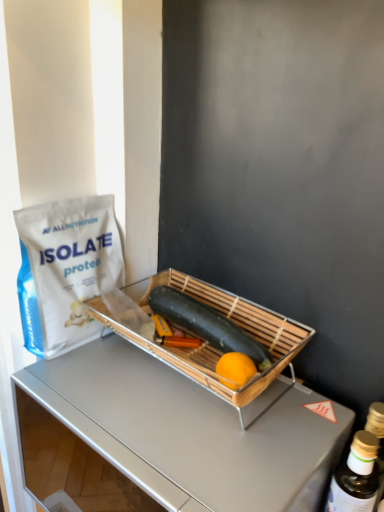
Locate an element on the screen. The width and height of the screenshot is (384, 512). smooth green zucchini at center is located at coordinates (207, 324).

Find the location of a particular element. The width and height of the screenshot is (384, 512). gold metallic bottle at right is located at coordinates (x=356, y=477).

What do you see at coordinates (212, 347) in the screenshot?
I see `bamboo tray at center` at bounding box center [212, 347].

The height and width of the screenshot is (512, 384). Describe the element at coordinates (65, 270) in the screenshot. I see `white matte protein powder bag at left` at that location.

Identify the location of smooth green zucchini at center. (207, 324).

Between smooth green zucchini at center and bamboo tray at center, which one has larger size?

With larger size is bamboo tray at center.

Where is `green vegetables behind the bamboo tray at center`? The width and height of the screenshot is (384, 512). green vegetables behind the bamboo tray at center is located at coordinates (207, 324).

Can we say smooth green zucchini at center lies outside bamboo tray at center?

No, smooth green zucchini at center is not entirely external to bamboo tray at center.

In the scene shown: From a real-world perspective, is smooth green zucchini at center on top of bamboo tray at center?

Yes.

Is point (29, 311) in front of point (215, 320)?

No.

Considering their positions, is white matte protein powder bag at left located in front of or behind smooth green zucchini at center?

white matte protein powder bag at left is in front of smooth green zucchini at center.

Identify the location of green vegetables below the white matte protein powder bag at left (from a real-world perspective). (207, 324).

Considering the positions of objects white matte protein powder bag at left and smooth green zucchini at center in the image provided, who is more to the right, white matte protein powder bag at left or smooth green zucchini at center?

Positioned to the right is smooth green zucchini at center.

From a real-world perspective, between bamboo tray at center and white matte protein powder bag at left, who is vertically higher?

white matte protein powder bag at left is physically above.

Is point (109, 318) positioned behind point (68, 324)?

Yes, it is.

From the picture: Is bamboo tray at center oriented towards white matte protein powder bag at left?

No, bamboo tray at center does not turn towards white matte protein powder bag at left.

I want to click on appliance on the right of white matte protein powder bag at left, so click(x=212, y=347).

In terms of height, does bamboo tray at center look taller or shorter compared to metallic silver desk at center?

Clearly, bamboo tray at center is shorter compared to metallic silver desk at center.

Can metallic silver desk at center be found inside bamboo tray at center?

No, metallic silver desk at center is not inside bamboo tray at center.

Is bamboo tray at center aimed at metallic silver desk at center?

No, bamboo tray at center is not turned towards metallic silver desk at center.

Between bamboo tray at center and metallic silver desk at center, which one appears on the right side from the viewer's perspective?

Positioned to the right is bamboo tray at center.

Based on their sizes in the image, would you say gold metallic bottle at right is bigger or smaller than bamboo tray at center?

Clearly, gold metallic bottle at right is smaller in size than bamboo tray at center.

Considering the points (360, 493) and (221, 385), which point is behind, point (360, 493) or point (221, 385)?

The point (221, 385) is behind.

Considering the relative sizes of gold metallic bottle at right and bamboo tray at center in the image provided, is gold metallic bottle at right thinner than bamboo tray at center?

Indeed, gold metallic bottle at right has a lesser width compared to bamboo tray at center.

Between gold metallic bottle at right and bamboo tray at center, which one has more height?

gold metallic bottle at right.

Is white matte protein powder bag at left completely or partially inside smooth green zucchini at center?

No.

Considering the sizes of smooth green zucchini at center and white matte protein powder bag at left in the image, is smooth green zucchini at center taller or shorter than white matte protein powder bag at left?

In the image, smooth green zucchini at center appears to be shorter than white matte protein powder bag at left.

Considering the sizes of smooth green zucchini at center and white matte protein powder bag at left in the image, is smooth green zucchini at center bigger or smaller than white matte protein powder bag at left?

Clearly, smooth green zucchini at center is smaller in size than white matte protein powder bag at left.

Is smooth green zucchini at center closer to the viewer compared to white matte protein powder bag at left?

No, smooth green zucchini at center is behind white matte protein powder bag at left.

From a real-world perspective, between metallic silver desk at center and white matte protein powder bag at left, who is vertically higher?

In real-world perspective, white matte protein powder bag at left is above.

Considering the positions of objects metallic silver desk at center and white matte protein powder bag at left in the image provided, who is more to the right, metallic silver desk at center or white matte protein powder bag at left?

metallic silver desk at center is more to the right.

Is metallic silver desk at center with white matte protein powder bag at left?

No, metallic silver desk at center is not with white matte protein powder bag at left.

What's the angular difference between metallic silver desk at center and white matte protein powder bag at left's facing directions?

metallic silver desk at center and white matte protein powder bag at left are facing 90 degrees away from each other.

The image size is (384, 512). Find the location of `green vegetables behind the bamboo tray at center`. green vegetables behind the bamboo tray at center is located at coordinates pos(207,324).

In order to click on grocery bag in front of the smooth green zucchini at center in this screenshot , I will do `click(65, 270)`.

Looking at this image, considering their positions, is gold metallic bottle at right positioned further to smooth green zucchini at center than white matte protein powder bag at left?

gold metallic bottle at right lies further to smooth green zucchini at center than the other object.

When comparing their distances from bamboo tray at center, does smooth green zucchini at center or gold metallic bottle at right seem closer?

smooth green zucchini at center lies closer to bamboo tray at center than the other object.

Which object lies nearer to the anchor point gold metallic bottle at right, bamboo tray at center or smooth green zucchini at center?

The object closer to gold metallic bottle at right is smooth green zucchini at center.

Looking at the image, which one is located further to white matte protein powder bag at left, smooth green zucchini at center or bamboo tray at center?

smooth green zucchini at center lies further to white matte protein powder bag at left than the other object.

Based on their spatial positions, is metallic silver desk at center or bamboo tray at center closer to gold metallic bottle at right?

Based on the image, bamboo tray at center appears to be nearer to gold metallic bottle at right.

Which object lies further to the anchor point bamboo tray at center, smooth green zucchini at center or white matte protein powder bag at left?

white matte protein powder bag at left lies further to bamboo tray at center than the other object.

Estimate the real-world distances between objects in this image. Which object is closer to metallic silver desk at center, white matte protein powder bag at left or smooth green zucchini at center?

white matte protein powder bag at left lies closer to metallic silver desk at center than the other object.

Considering their positions, is gold metallic bottle at right positioned further to metallic silver desk at center than bamboo tray at center?

gold metallic bottle at right.

In order to click on green vegetables between white matte protein powder bag at left and metallic silver desk at center vertically in this screenshot , I will do `click(207, 324)`.

The height and width of the screenshot is (512, 384). Identify the location of appliance between white matte protein powder bag at left and gold metallic bottle at right. (212, 347).

The image size is (384, 512). What are the coordinates of `desk situated between white matte protein powder bag at left and gold metallic bottle at right from left to right` in the screenshot? It's located at (166, 438).

The image size is (384, 512). Identify the location of appliance between smooth green zucchini at center and metallic silver desk at center from top to bottom. (212, 347).